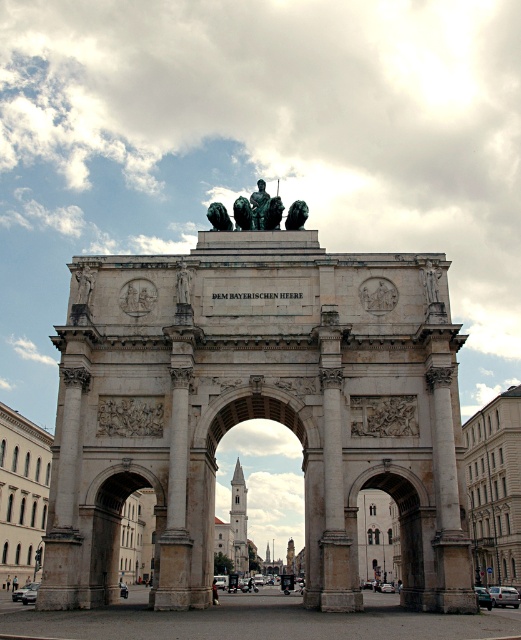
Describe the element at coordinates (249, 211) in the screenshot. I see `green patina statue at center` at that location.

Is point (254, 209) farther from viewer compared to point (188, 269)?

Yes, point (254, 209) is farther from viewer.

Is point (277, 227) positioned before point (181, 285)?

No, (277, 227) is behind (181, 285).

Locate an element on the screen. green patina statue at center is located at coordinates (249, 211).

Is bronze statue at upper left further to camera compared to bronze statue at center?

Yes, it is.

Can you confirm if bronze statue at upper left is taller than bronze statue at center?

No, bronze statue at upper left is not taller than bronze statue at center.

Where is `bronze statue at upper left`? bronze statue at upper left is located at coordinates (84, 285).

Is polished stone arch at center smaller than bronze statue at upper right?

Actually, polished stone arch at center might be larger than bronze statue at upper right.

Can you confirm if polished stone arch at center is positioned above bronze statue at upper right?

Actually, polished stone arch at center is below bronze statue at upper right.

At what (x,y) coordinates should I click in order to perform the action: click on polished stone arch at center. Please return your answer as a coordinate pair (x, y). Looking at the image, I should click on (257, 412).